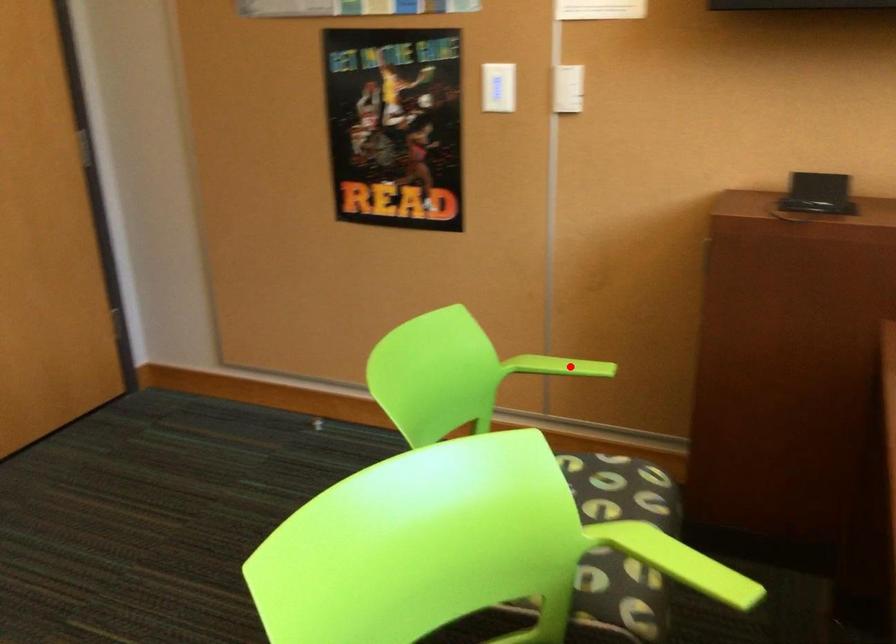
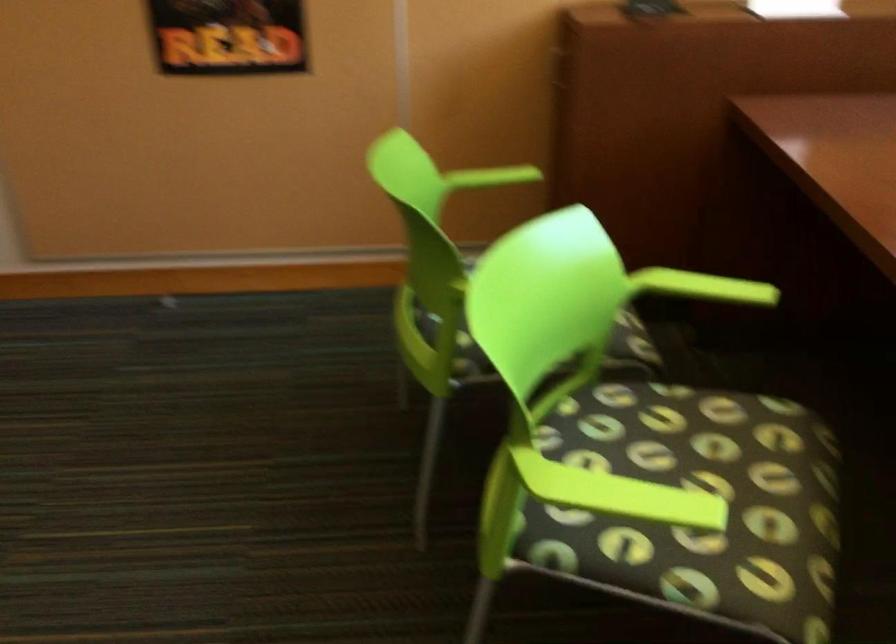
Question: I am providing you with two images of the same scene from different viewpoints. Given a red point in image1, look at the same physical point in image2. Is it:

Choices:
 (A) Closer to the viewpoint
 (B) Farther from the viewpoint

Answer: (B)